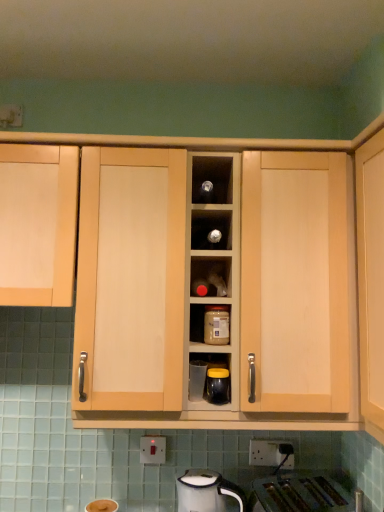
Question: Is light wood cabinet at center, which is the first cabinetry in right-to-left order, further to camera compared to white plastic electric outlet at lower center?

Choices:
 (A) no
 (B) yes

Answer: (A)

Question: Does light wood cabinet at center, which is the first cabinetry in right-to-left order, have a lesser height compared to white plastic electric outlet at lower center?

Choices:
 (A) yes
 (B) no

Answer: (B)

Question: From a real-world perspective, is light wood cabinet at center, positioned as the second cabinetry in left-to-right order, positioned over white plastic electric outlet at lower center based on gravity?

Choices:
 (A) no
 (B) yes

Answer: (B)

Question: Is light wood cabinet at center, positioned as the second cabinetry in left-to-right order, oriented towards white plastic electric outlet at lower center?

Choices:
 (A) no
 (B) yes

Answer: (A)

Question: Is light wood cabinet at center, positioned as the second cabinetry in left-to-right order, facing away from white plastic electric outlet at lower center?

Choices:
 (A) yes
 (B) no

Answer: (B)

Question: Can you confirm if light wood cabinet at center, which is the first cabinetry in right-to-left order, is taller than white plastic electric outlet at lower center?

Choices:
 (A) yes
 (B) no

Answer: (A)

Question: Does white plastic electric outlet at lower center come behind matte black jar at center, the first appliance when ordered from front to back?

Choices:
 (A) no
 (B) yes

Answer: (B)

Question: Can you confirm if white plastic electric outlet at lower center is bigger than matte black jar at center, the first appliance when ordered from front to back?

Choices:
 (A) yes
 (B) no

Answer: (B)

Question: From a real-world perspective, is white plastic electric outlet at lower center on matte black jar at center, marked as the second appliance in a left-to-right arrangement?

Choices:
 (A) yes
 (B) no

Answer: (B)

Question: From the image's perspective, does white plastic electric outlet at lower center appear lower than matte black jar at center, the first appliance when ordered from front to back?

Choices:
 (A) yes
 (B) no

Answer: (A)

Question: Can you confirm if white plastic electric outlet at lower center is smaller than matte black jar at center, marked as the second appliance in a left-to-right arrangement?

Choices:
 (A) yes
 (B) no

Answer: (A)

Question: Is white plastic electric outlet at lower center shorter than matte black jar at center, which ranks as the second appliance in back-to-front order?

Choices:
 (A) yes
 (B) no

Answer: (B)

Question: From a real-world perspective, does clear glass jar at center, the 2th appliance from the front, stand above white plastic electric outlet at lower center?

Choices:
 (A) no
 (B) yes

Answer: (B)